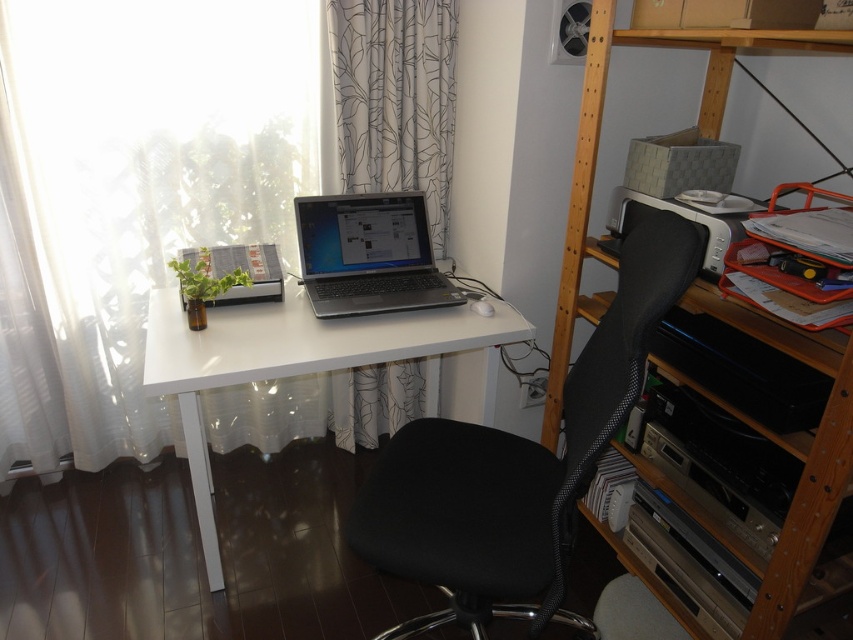
Is white sheer curtain at left above white glossy table at center?

Yes.

Can you confirm if white sheer curtain at left is taller than white glossy table at center?

Yes.

Where is `white sheer curtain at left`? white sheer curtain at left is located at coordinates (135, 192).

I want to click on white sheer curtain at left, so click(x=135, y=192).

Which of these two, white glossy table at center or wooden bookshelf at upper right, stands shorter?

Standing shorter between the two is white glossy table at center.

Looking at this image, can you confirm if white glossy table at center is wider than wooden bookshelf at upper right?

Indeed, white glossy table at center has a greater width compared to wooden bookshelf at upper right.

Find the location of a particular element. The height and width of the screenshot is (640, 853). white glossy table at center is located at coordinates [x=300, y=362].

What are the coordinates of `white glossy table at center` in the screenshot? It's located at (300, 362).

Does black fabric swivel chair at center have a smaller size compared to white glossy table at center?

Correct, black fabric swivel chair at center occupies less space than white glossy table at center.

Between point (474, 438) and point (212, 348), which one is positioned behind?

The point (212, 348) is more distant.

Is point (457, 451) closer to viewer compared to point (267, 323)?

Yes, point (457, 451) is closer to viewer.

Find the location of a particular element. This screenshot has height=640, width=853. black fabric swivel chair at center is located at coordinates [518, 465].